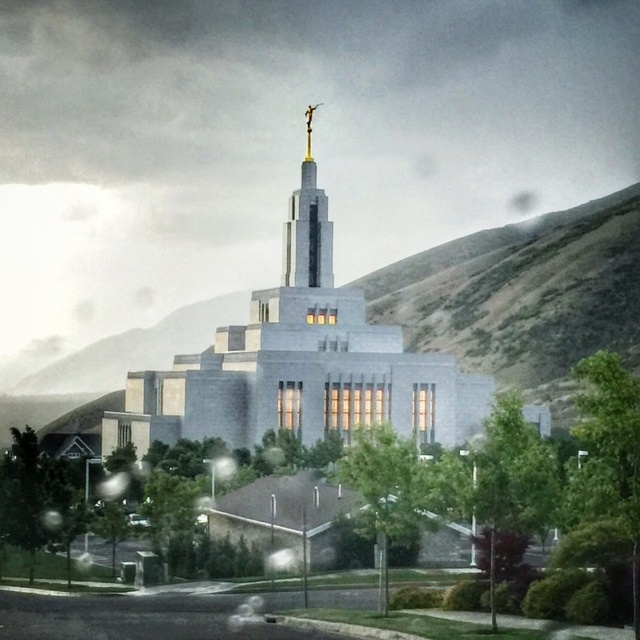
Which is in front, point (419, 488) or point (36, 513)?

Positioned in front is point (419, 488).

Measure the distance from green leafy tree at center to green leafy tree at lower left.

green leafy tree at center is 23.59 meters away from green leafy tree at lower left.

Does point (406, 506) come behind point (40, 509)?

No, it is not.

Image resolution: width=640 pixels, height=640 pixels. Identify the location of green leafy tree at center. (385, 490).

Is green leafy tree at lower left closer to camera compared to gold polished spire at center?

A: Yes, green leafy tree at lower left is in front of gold polished spire at center.

Is point (44, 522) in front of point (332, 248)?

Yes, it is.

The width and height of the screenshot is (640, 640). In order to click on green leafy tree at lower left in this screenshot , I will do `click(32, 493)`.

Is green leafy tree at center positioned behind gold polished spire at center?

No, green leafy tree at center is in front of gold polished spire at center.

Is green leafy tree at center wider than gold polished spire at center?

Incorrect, green leafy tree at center's width does not surpass gold polished spire at center's.

In order to click on green leafy tree at center in this screenshot , I will do `click(385, 490)`.